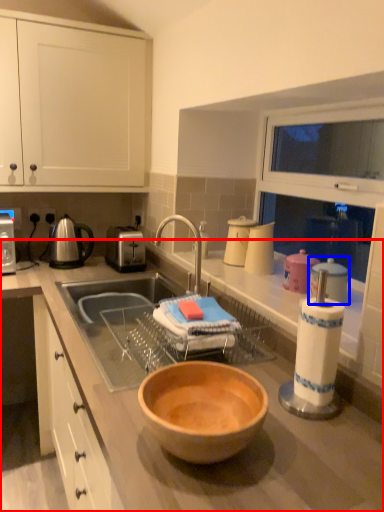
Question: Among these objects, which one is nearest to the camera, countertop (highlighted by a red box) or appliance (highlighted by a blue box)?

Choices:
 (A) countertop
 (B) appliance

Answer: (A)